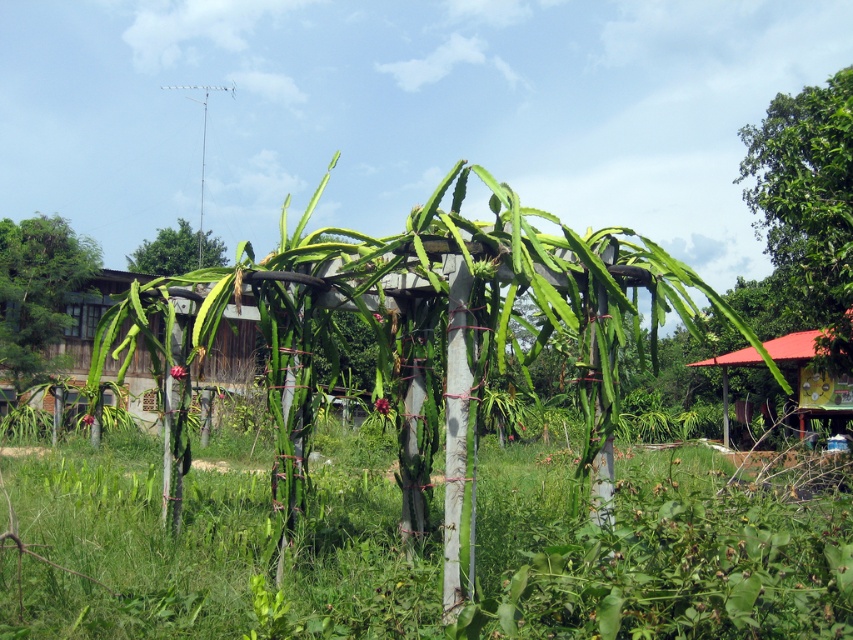
Question: Is green leafy grass at center thinner than red corrugated metal hut at center right?

Choices:
 (A) no
 (B) yes

Answer: (A)

Question: Considering the real-world distances, which object is farthest from the green leafy plant at center?

Choices:
 (A) green leafy tree at upper right
 (B) green leafy grass at center
 (C) red corrugated metal hut at center right
 (D) green leafy plant at upper center

Answer: (D)

Question: Which point appears closest to the camera in this image?

Choices:
 (A) (164, 252)
 (B) (712, 595)

Answer: (B)

Question: Can you confirm if green leafy grass at center is positioned above green leafy plant at center?

Choices:
 (A) no
 (B) yes

Answer: (A)

Question: Which object is closer to the camera taking this photo?

Choices:
 (A) green leafy tree at upper right
 (B) green leafy plant at center
 (C) green leafy plant at upper center

Answer: (B)

Question: In this image, where is red corrugated metal hut at center right located relative to green leafy plant at upper center?

Choices:
 (A) below
 (B) above

Answer: (A)